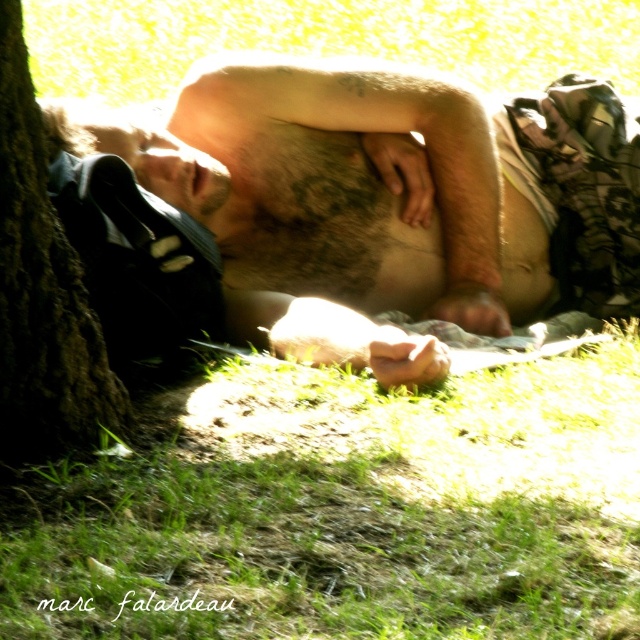
Question: Is green grass at lower center to the right of brown rough bark at left from the viewer's perspective?

Choices:
 (A) yes
 (B) no

Answer: (A)

Question: Among these objects, which one is farthest from the camera?

Choices:
 (A) hairy skin at center
 (B) brown rough bark at left
 (C) green grass at lower center

Answer: (A)

Question: Does green grass at lower center appear over brown rough bark at left?

Choices:
 (A) yes
 (B) no

Answer: (B)

Question: Considering the relative positions of green grass at lower center and hairy skin at center in the image provided, where is green grass at lower center located with respect to hairy skin at center?

Choices:
 (A) below
 (B) above

Answer: (A)

Question: Which point is farther to the camera?

Choices:
 (A) brown rough bark at left
 (B) green grass at lower center
 (C) hairy skin at center

Answer: (C)

Question: Which object is positioned farthest from the brown rough bark at left?

Choices:
 (A) green grass at lower center
 (B) hairy skin at center

Answer: (B)